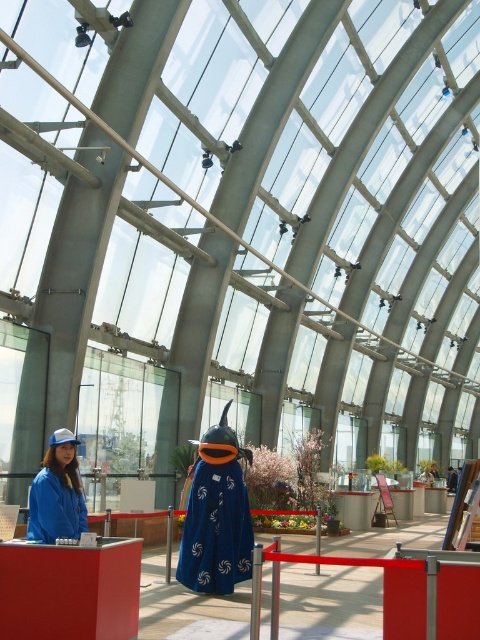
Does blue fabric dress at center lie in front of blue fabric jacket at lower left?

That is False.

Does point (201, 483) lie in front of point (64, 465)?

No, it is behind (64, 465).

Who is more forward, (x=200, y=582) or (x=62, y=436)?

Point (x=62, y=436) is in front.

Identify the location of blue fabric dress at center. (216, 529).